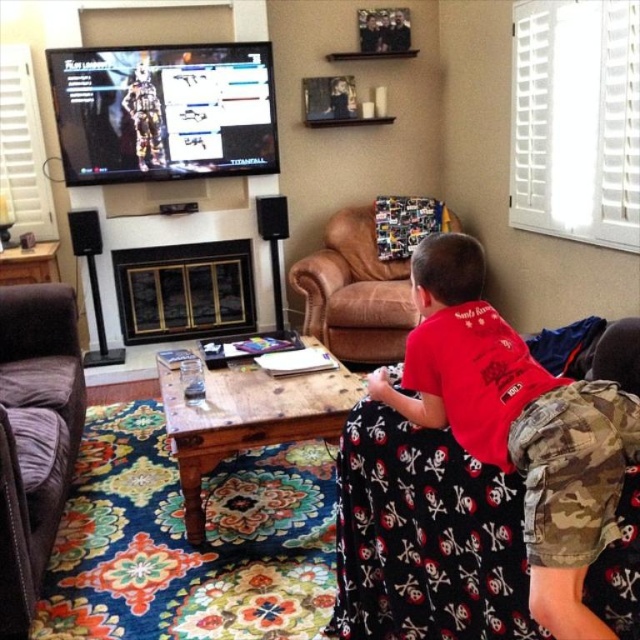
Question: Is red cotton shirt at lower right wider than metallic gun at upper center?

Choices:
 (A) no
 (B) yes

Answer: (A)

Question: Is red cotton shirt at lower right thinner than metallic gun at upper center?

Choices:
 (A) no
 (B) yes

Answer: (B)

Question: Is red cotton shirt at lower right bigger than brown fabric armchair at lower left?

Choices:
 (A) no
 (B) yes

Answer: (A)

Question: Which point appears farthest from the camera in this image?

Choices:
 (A) (54, 60)
 (B) (16, 480)
 (C) (580, 637)
 (D) (352, 243)

Answer: (D)

Question: Which object appears farthest from the camera in this image?

Choices:
 (A) brown leather armchair at center
 (B) brown fabric armchair at lower left
 (C) red cotton shirt at lower right
 (D) metallic gun at upper center

Answer: (D)

Question: Which of the following is the closest to the observer?

Choices:
 (A) (67, 486)
 (B) (548, 566)
 (C) (324, 248)

Answer: (B)